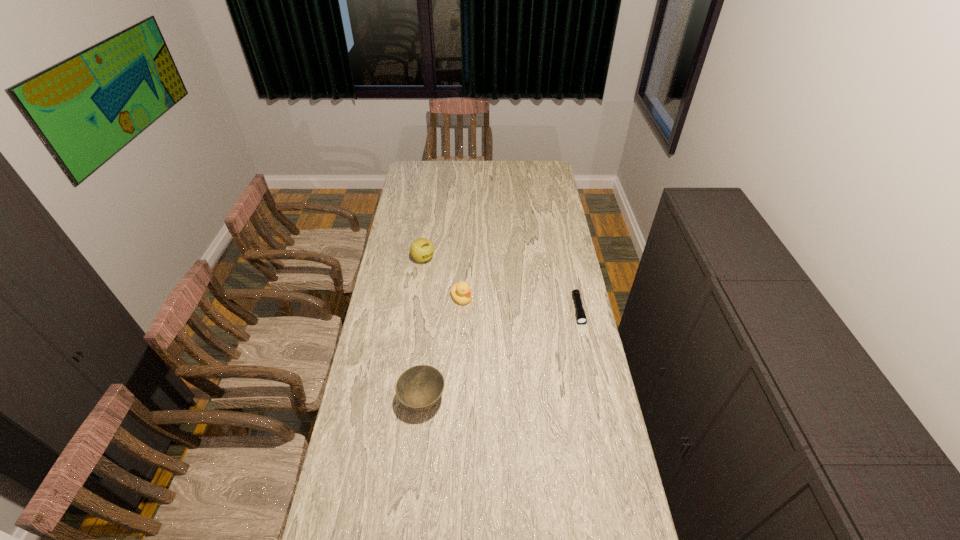
The height and width of the screenshot is (540, 960). Find the location of `vacant space on the desktop that is between the bowl and the flashlight and is positioned on the logo side of the softball`. vacant space on the desktop that is between the bowl and the flashlight and is positioned on the logo side of the softball is located at coordinates (518, 345).

Locate an element on the screen. The image size is (960, 540). free space on the desktop that is between the nearest object and the rightmost object and is positioned on the face of the duckling is located at coordinates (510, 350).